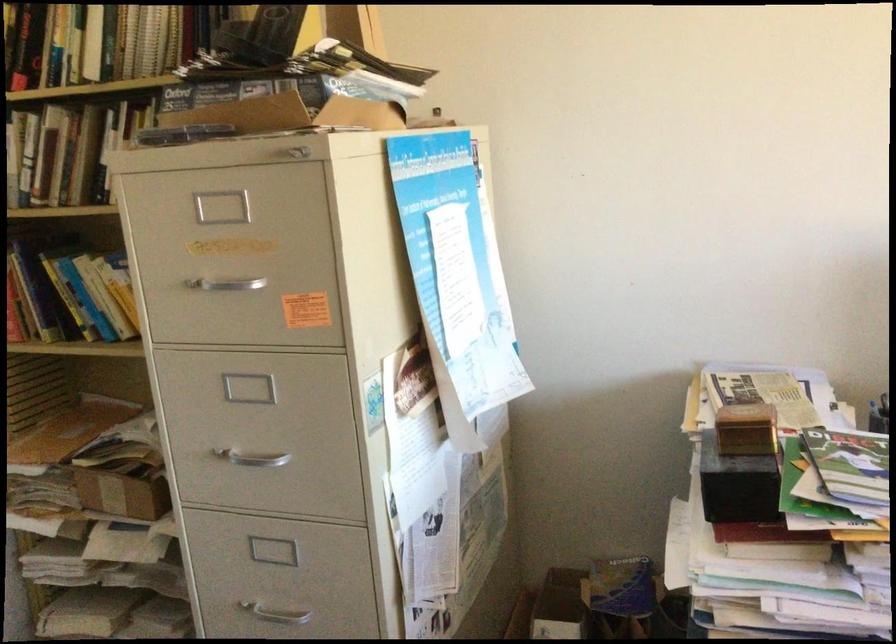
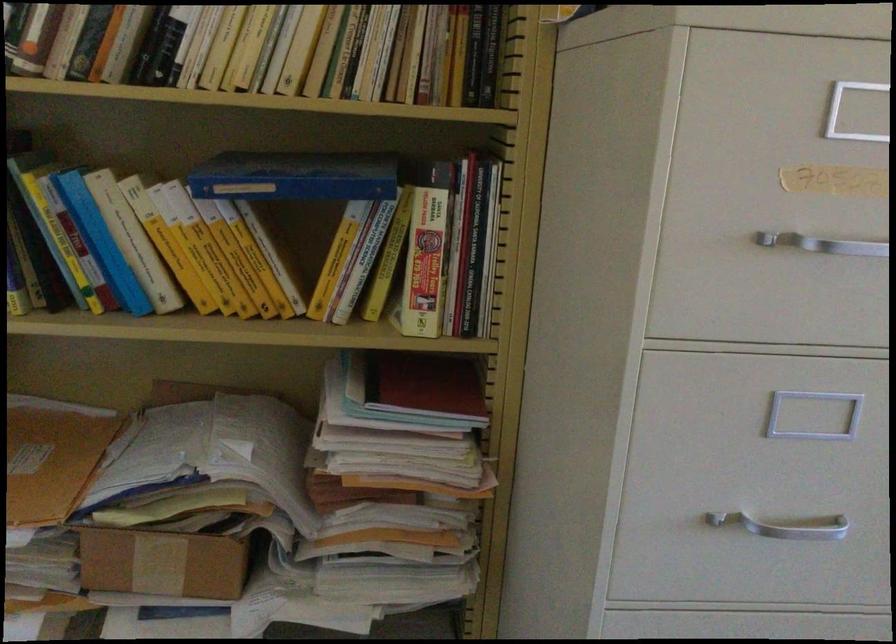
In the second image, find the point that corresponds to pixel 271 462 in the first image.

(784, 526)